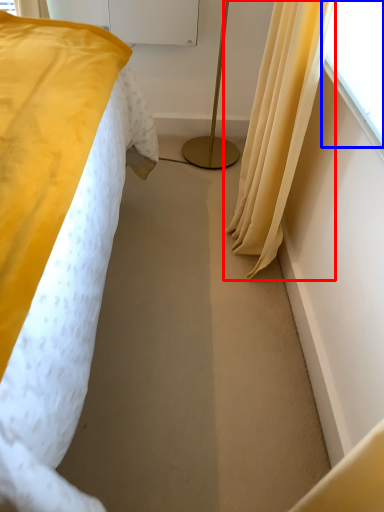
Question: Which point is closer to the camera, curtain (highlighted by a red box) or window screen (highlighted by a blue box)?

Choices:
 (A) curtain
 (B) window screen

Answer: (B)